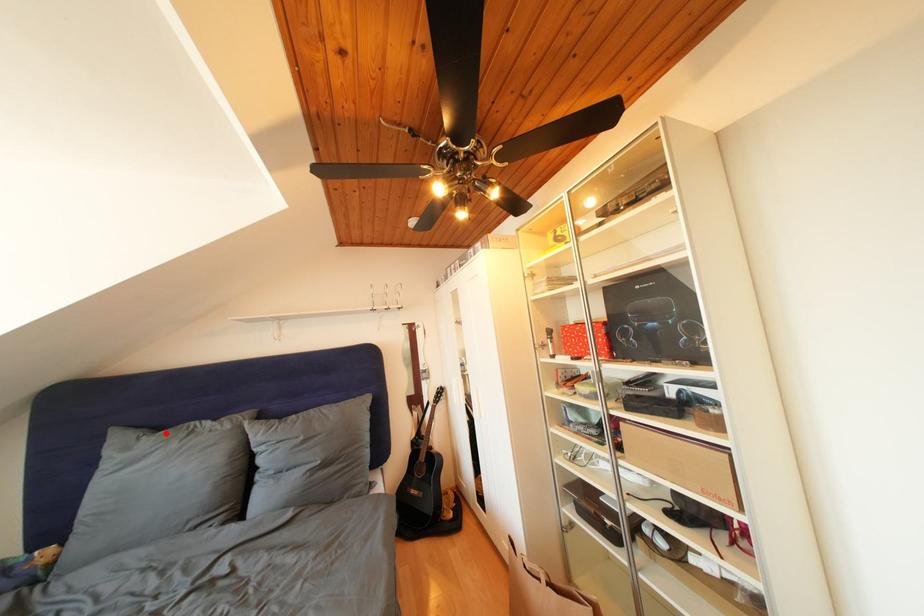
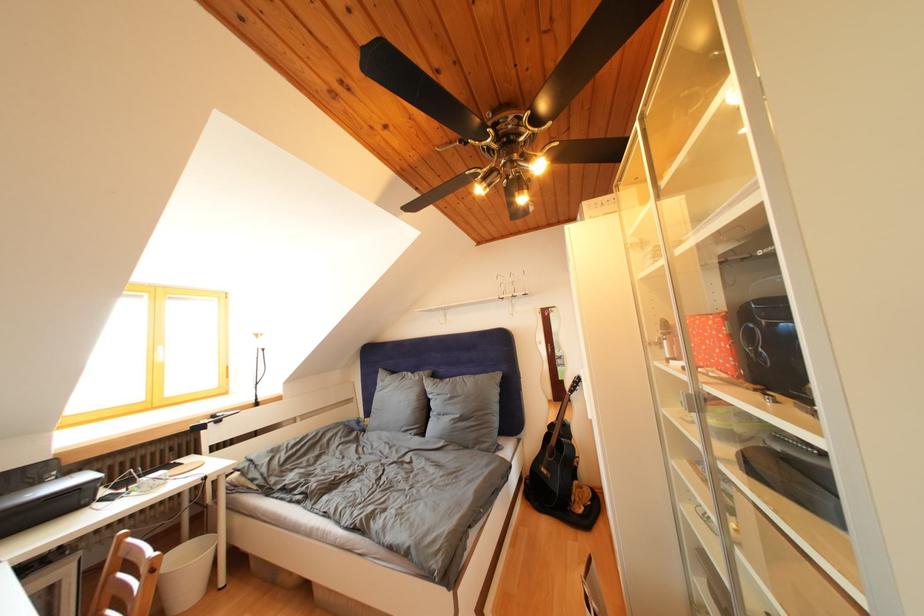
Find the pixel in the second image that matches the highlighted location in the first image.

(400, 378)